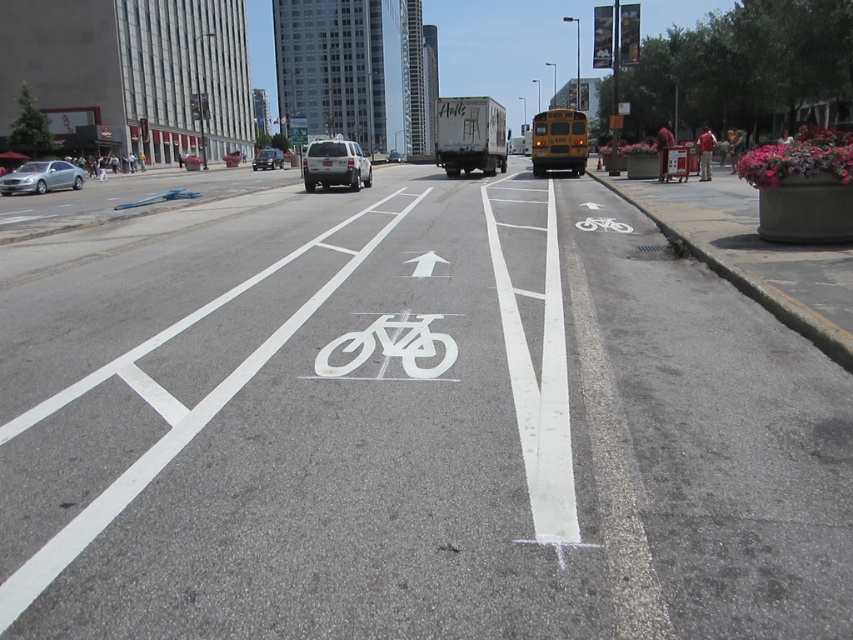
You are a delivery person trying to load a tall package into your van. You see a yellow matte school bus at center and a silver metallic suv at center in the street. Which vehicle is taller and can accommodate the package?

The yellow matte school bus at center is taller than the silver metallic suv at center, so it can accommodate the tall package.

Looking at this image, you are a cyclist approaching the bike lane in the city scene. You see a yellow matte school bus at center and a silver metallic suv at center. Which vehicle should you be cautious of first?

The yellow matte school bus at center is closer to the viewer than the silver metallic suv at center, so you should be cautious of the yellow matte school bus at center first.